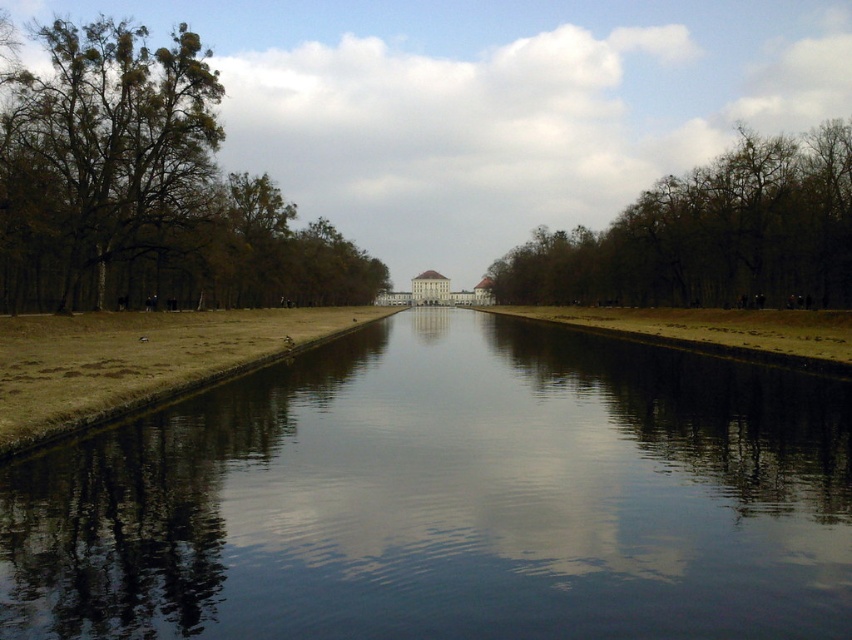
You are a landscape architect designing a walking path that needs to be 200 feet long. Based on the scene, can you confirm if the distance between the smooth reflective water at center and the brown leafless trees at center is sufficient for your path?

The distance between the smooth reflective water at center and the brown leafless trees at center is 233.00 feet, which is longer than the required 200 feet. Therefore, the space between them is sufficient for the 200 feet long walking path.

You are standing on the sandy path at the left side of the canal and want to take a photo of the green leafy tree at left and the smooth reflective water at center. Which object will appear higher in the photo?

The green leafy tree at left will appear higher in the photo because the smooth reflective water at center is below it.

You are standing on the sandy path next to the green leafy tree at left and want to cross to the other side of the smooth reflective water at center. Which direction should you walk to reach the opposite side of the water?

You should walk to the right side of the green leafy tree at left because the smooth reflective water at center is positioned on the right side of it, so moving in that direction will lead you to the opposite side of the water.